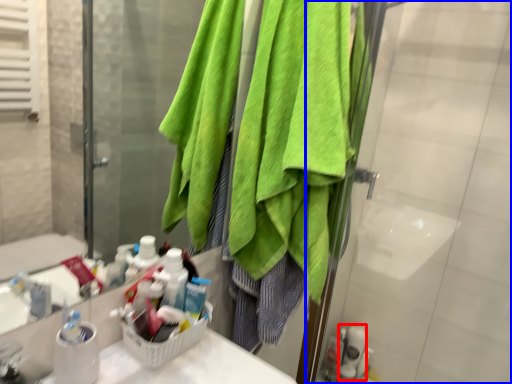
Question: Which object is closer to the camera taking this photo, toiletry (highlighted by a red box) or screen door (highlighted by a blue box)?

Choices:
 (A) toiletry
 (B) screen door

Answer: (B)